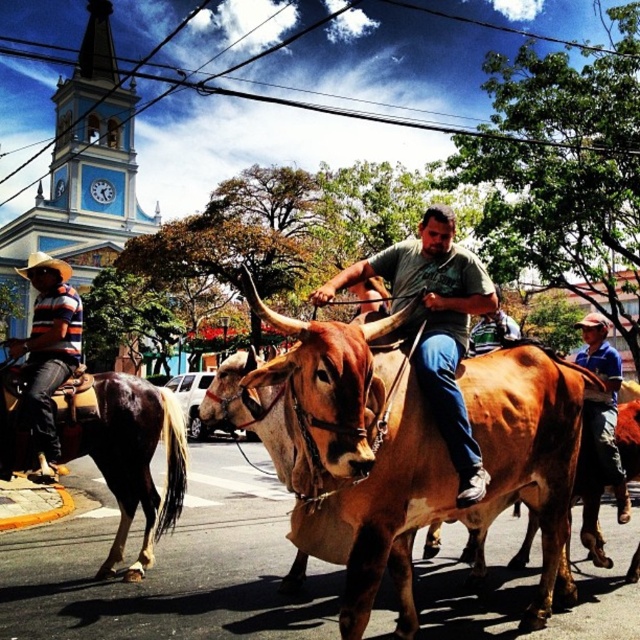
Question: Is matte green shirt at center below striped cotton shirt at left?

Choices:
 (A) yes
 (B) no

Answer: (A)

Question: Among these objects, which one is nearest to the camera?

Choices:
 (A) striped cotton shirt at left
 (B) brown glossy horse at lower left
 (C) matte green shirt at center
 (D) brown leather bull at center

Answer: (D)

Question: Can you confirm if matte green shirt at center is positioned above striped cotton shirt at left?

Choices:
 (A) no
 (B) yes

Answer: (A)

Question: Which object is farther from the camera taking this photo?

Choices:
 (A) brown glossy horse at lower left
 (B) matte green shirt at center
 (C) striped cotton shirt at left

Answer: (C)

Question: Can you confirm if brown glossy horse at lower left is positioned below striped cotton shirt at left?

Choices:
 (A) yes
 (B) no

Answer: (A)

Question: Which object is farther from the camera taking this photo?

Choices:
 (A) matte green shirt at center
 (B) brown glossy horse at lower left

Answer: (B)